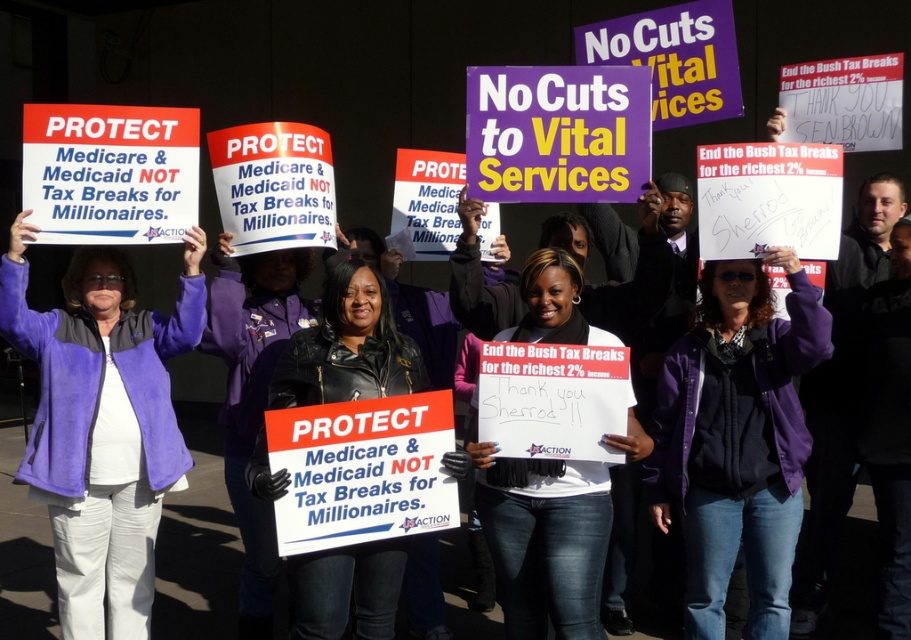
Between white matte sign at center and matte purple jacket at center, which one appears on the right side from the viewer's perspective?

white matte sign at center is more to the right.

This screenshot has width=911, height=640. Describe the element at coordinates (545, 540) in the screenshot. I see `white matte sign at center` at that location.

Locate an element on the screen. The height and width of the screenshot is (640, 911). white matte sign at center is located at coordinates (545, 540).

Looking at this image, between purple fleece jacket at center and black leather jacket at center, which one is positioned higher?

black leather jacket at center is higher up.

Is purple fleece jacket at center below black leather jacket at center?

Yes, purple fleece jacket at center is below black leather jacket at center.

Locate an element on the screen. purple fleece jacket at center is located at coordinates (737, 440).

Find the location of a particular element. The image size is (911, 640). purple fleece jacket at center is located at coordinates (737, 440).

Who is more forward, (x=55, y=316) or (x=254, y=324)?

Positioned in front is point (x=55, y=316).

Which is in front, point (115, 282) or point (254, 321)?

Point (115, 282) is more forward.

Locate an element on the screen. purple fleece jacket at left is located at coordinates [101, 426].